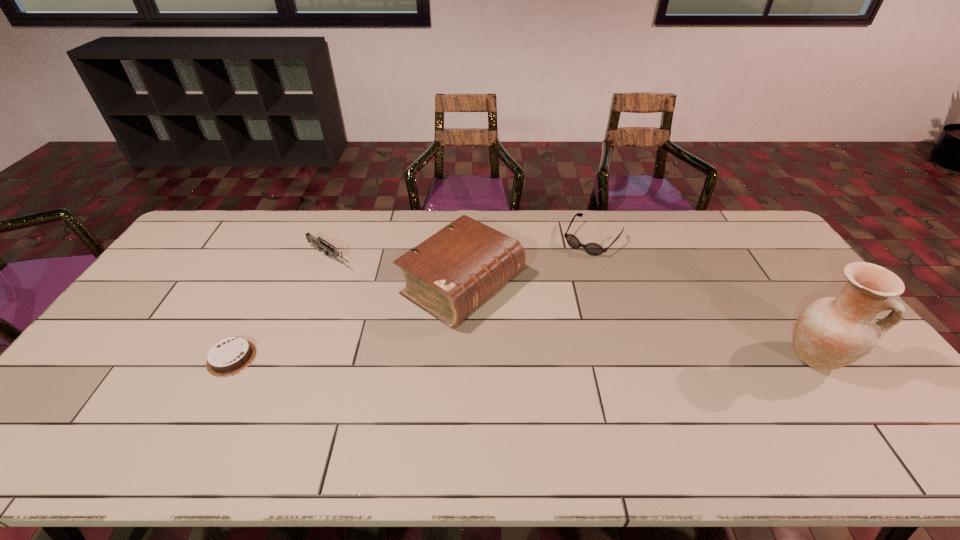
This screenshot has width=960, height=540. What are the coordinates of `the shortest object` in the screenshot? It's located at (230, 356).

You are a GUI agent. You are given a task and a screenshot of the screen. Output one action in this format:
    pyautogui.click(x=<x>, y=<y>)
    Task: Click on the leftmost object
    
    Given the screenshot: What is the action you would take?
    pyautogui.click(x=230, y=356)

Locate an element on the screen. This screenshot has width=960, height=540. the rightmost object is located at coordinates (831, 332).

The height and width of the screenshot is (540, 960). What are the coordinates of `the tallest object` in the screenshot? It's located at (831, 332).

Where is `the second tallest object`? This screenshot has width=960, height=540. the second tallest object is located at coordinates (452, 273).

At what (x,y) coordinates should I click in order to perform the action: click on the third object from left to right. Please return your answer as a coordinate pair (x, y). Image resolution: width=960 pixels, height=540 pixels. Looking at the image, I should click on (452, 273).

Find the location of `sunglasses`. sunglasses is located at coordinates (594, 249).

The height and width of the screenshot is (540, 960). I want to click on the fourth tallest object, so click(594, 249).

I want to click on the third tallest object, so click(x=317, y=242).

I want to click on gun, so click(317, 242).